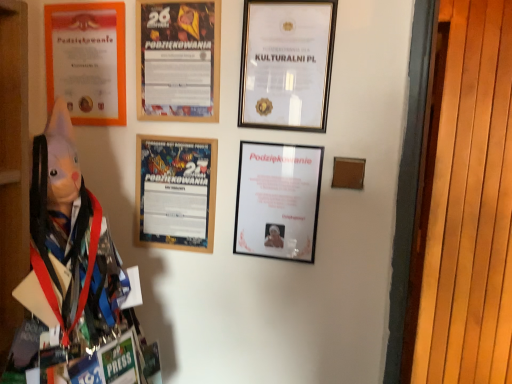
Measure the distance between gold-framed certificate at upper center, placed as the first picture frame when sorted from right to left, and camera.

gold-framed certificate at upper center, placed as the first picture frame when sorted from right to left, is 1.04 meters away from camera.

What do you see at coordinates (278, 200) in the screenshot?
I see `matte black picture frame at center, the third picture frame positioned from the left` at bounding box center [278, 200].

Identify the location of matte black picture frame at center, the 2th picture frame when ordered from right to left. (278, 200).

Identify the location of matte orange certificate at upper left, the first picture frame from the left. (87, 61).

This screenshot has width=512, height=384. I want to click on gold-framed certificate at upper center, placed as the first picture frame when sorted from right to left, so click(286, 64).

Considering the relative positions of matte paper poster at center and wooden framed poster at center, positioned as the 3th picture frame in right-to-left order, in the image provided, is matte paper poster at center to the right of wooden framed poster at center, positioned as the 3th picture frame in right-to-left order, from the viewer's perspective?

Correct, you'll find matte paper poster at center to the right of wooden framed poster at center, positioned as the 3th picture frame in right-to-left order.

Between matte paper poster at center and wooden framed poster at center, positioned as the 3th picture frame in right-to-left order, which one has less height?

wooden framed poster at center, positioned as the 3th picture frame in right-to-left order.

Would you say matte paper poster at center contains wooden framed poster at center, positioned as the 3th picture frame in right-to-left order?

No, wooden framed poster at center, positioned as the 3th picture frame in right-to-left order, is not inside matte paper poster at center.

Is matte paper poster at center smaller than wooden framed poster at center, which is counted as the 2th picture frame, starting from the left?

Incorrect, matte paper poster at center is not smaller in size than wooden framed poster at center, which is counted as the 2th picture frame, starting from the left.

Is wooden framed poster at center, positioned as the 3th picture frame in right-to-left order, at the back of gold-framed certificate at upper center, the fourth picture frame in the left-to-right sequence?

gold-framed certificate at upper center, the fourth picture frame in the left-to-right sequence, is not turned away from wooden framed poster at center, positioned as the 3th picture frame in right-to-left order.

Is gold-framed certificate at upper center, the fourth picture frame in the left-to-right sequence, not near wooden framed poster at center, which is counted as the 2th picture frame, starting from the left?

gold-framed certificate at upper center, the fourth picture frame in the left-to-right sequence, is near wooden framed poster at center, which is counted as the 2th picture frame, starting from the left, not far away.

Does gold-framed certificate at upper center, placed as the first picture frame when sorted from right to left, have a lesser height compared to wooden framed poster at center, which is counted as the 2th picture frame, starting from the left?

No.

From a real-world perspective, is gold-framed certificate at upper center, the fourth picture frame in the left-to-right sequence, on wooden framed poster at center, positioned as the 3th picture frame in right-to-left order?

Yes, from a real-world perspective, gold-framed certificate at upper center, the fourth picture frame in the left-to-right sequence, is above wooden framed poster at center, positioned as the 3th picture frame in right-to-left order.

Is matte orange certificate at upper left, the first picture frame from the left, at the back of gold-framed certificate at upper center, placed as the first picture frame when sorted from right to left?

No, gold-framed certificate at upper center, placed as the first picture frame when sorted from right to left, is not facing away from matte orange certificate at upper left, the first picture frame from the left.

Do you think gold-framed certificate at upper center, placed as the first picture frame when sorted from right to left, is within matte orange certificate at upper left, the fourth picture frame in the right-to-left sequence, or outside of it?

gold-framed certificate at upper center, placed as the first picture frame when sorted from right to left, is not enclosed by matte orange certificate at upper left, the fourth picture frame in the right-to-left sequence.

Which is more to the left, gold-framed certificate at upper center, placed as the first picture frame when sorted from right to left, or matte orange certificate at upper left, the first picture frame from the left?

From the viewer's perspective, matte orange certificate at upper left, the first picture frame from the left, appears more on the left side.

From a real-world perspective, is gold-framed certificate at upper center, placed as the first picture frame when sorted from right to left, beneath matte orange certificate at upper left, the fourth picture frame in the right-to-left sequence?

No, from a real-world perspective, gold-framed certificate at upper center, placed as the first picture frame when sorted from right to left, is not under matte orange certificate at upper left, the fourth picture frame in the right-to-left sequence.

Which object is more forward, matte orange certificate at upper left, the fourth picture frame in the right-to-left sequence, or matte paper poster at center?

matte paper poster at center is more forward.

From a real-world perspective, which object rests below the other?

In real-world perspective, matte orange certificate at upper left, the first picture frame from the left, is lower.

How different are the orientations of matte orange certificate at upper left, the first picture frame from the left, and matte paper poster at center in degrees?

matte orange certificate at upper left, the first picture frame from the left, and matte paper poster at center are facing 0.00135 degrees away from each other.

Identify the location of poster below the matte orange certificate at upper left, the first picture frame from the left (from the image's perspective). (178, 60).

Is matte paper poster at center next to gold-framed certificate at upper center, the fourth picture frame in the left-to-right sequence, and touching it?

They are not placed beside each other.

I want to click on poster below the gold-framed certificate at upper center, placed as the first picture frame when sorted from right to left (from a real-world perspective), so click(x=178, y=60).

Does matte paper poster at center have a lesser width compared to gold-framed certificate at upper center, placed as the first picture frame when sorted from right to left?

No.

Is matte paper poster at center positioned beyond the bounds of matte black picture frame at center, the third picture frame positioned from the left?

Yes.

Is matte black picture frame at center, the third picture frame positioned from the left, at the back of matte paper poster at center?

No, matte paper poster at center is not facing away from matte black picture frame at center, the third picture frame positioned from the left.

Visually, is matte paper poster at center positioned to the left or to the right of matte black picture frame at center, the third picture frame positioned from the left?

matte paper poster at center is positioned on matte black picture frame at center, the third picture frame positioned from the left,'s left side.

From the image's perspective, between matte paper poster at center and matte black picture frame at center, the 2th picture frame when ordered from right to left, which one is located above?

matte paper poster at center, from the image's perspective.

From the image's perspective, which is below, wooden framed poster at center, positioned as the 3th picture frame in right-to-left order, or matte black picture frame at center, the 2th picture frame when ordered from right to left?

matte black picture frame at center, the 2th picture frame when ordered from right to left.

Which of these two, wooden framed poster at center, positioned as the 3th picture frame in right-to-left order, or matte black picture frame at center, the third picture frame positioned from the left, stands taller?

matte black picture frame at center, the third picture frame positioned from the left, is taller.

Could you tell me if wooden framed poster at center, positioned as the 3th picture frame in right-to-left order, is turned towards matte black picture frame at center, the 2th picture frame when ordered from right to left?

No, wooden framed poster at center, positioned as the 3th picture frame in right-to-left order, is not turned towards matte black picture frame at center, the 2th picture frame when ordered from right to left.

This screenshot has height=384, width=512. Identify the location of poster located in front of the wooden framed poster at center, positioned as the 3th picture frame in right-to-left order. (178, 60).

From the image's perspective, count 1st picture frames downward from the gold-framed certificate at upper center, the fourth picture frame in the left-to-right sequence, and point to it. Please provide its 2D coordinates.

[(176, 192)]

Which object lies further to the anchor point matte paper poster at center, matte orange certificate at upper left, the first picture frame from the left, or matte black picture frame at center, the 2th picture frame when ordered from right to left?

matte black picture frame at center, the 2th picture frame when ordered from right to left, is positioned further to the anchor matte paper poster at center.

From the image, which object appears to be nearer to gold-framed certificate at upper center, the fourth picture frame in the left-to-right sequence, wooden framed poster at center, positioned as the 3th picture frame in right-to-left order, or matte orange certificate at upper left, the first picture frame from the left?

Among the two, wooden framed poster at center, positioned as the 3th picture frame in right-to-left order, is located nearer to gold-framed certificate at upper center, the fourth picture frame in the left-to-right sequence.

Estimate the real-world distances between objects in this image. Which object is closer to matte orange certificate at upper left, the fourth picture frame in the right-to-left sequence, matte black picture frame at center, the third picture frame positioned from the left, or wooden framed poster at center, positioned as the 3th picture frame in right-to-left order?

wooden framed poster at center, positioned as the 3th picture frame in right-to-left order, is closer to matte orange certificate at upper left, the fourth picture frame in the right-to-left sequence.

Considering their positions, is matte orange certificate at upper left, the first picture frame from the left, positioned further to matte black picture frame at center, the third picture frame positioned from the left, than gold-framed certificate at upper center, placed as the first picture frame when sorted from right to left?

matte orange certificate at upper left, the first picture frame from the left, is positioned further to the anchor matte black picture frame at center, the third picture frame positioned from the left.

From the image, which object appears to be nearer to matte black picture frame at center, the third picture frame positioned from the left, matte orange certificate at upper left, the first picture frame from the left, or wooden framed poster at center, which is counted as the 2th picture frame, starting from the left?

Among the two, wooden framed poster at center, which is counted as the 2th picture frame, starting from the left, is located nearer to matte black picture frame at center, the third picture frame positioned from the left.

Considering their positions, is matte paper poster at center positioned further to gold-framed certificate at upper center, the fourth picture frame in the left-to-right sequence, than matte orange certificate at upper left, the fourth picture frame in the right-to-left sequence?

Among the two, matte orange certificate at upper left, the fourth picture frame in the right-to-left sequence, is located further to gold-framed certificate at upper center, the fourth picture frame in the left-to-right sequence.

From the image, which object appears to be farther from wooden framed poster at center, positioned as the 3th picture frame in right-to-left order, gold-framed certificate at upper center, placed as the first picture frame when sorted from right to left, or matte orange certificate at upper left, the first picture frame from the left?

gold-framed certificate at upper center, placed as the first picture frame when sorted from right to left, lies further to wooden framed poster at center, positioned as the 3th picture frame in right-to-left order, than the other object.

Looking at the image, which one is located further to matte paper poster at center, matte black picture frame at center, the third picture frame positioned from the left, or matte orange certificate at upper left, the fourth picture frame in the right-to-left sequence?

The object further to matte paper poster at center is matte black picture frame at center, the third picture frame positioned from the left.

What are the coordinates of `poster between matte orange certificate at upper left, the first picture frame from the left, and matte black picture frame at center, the third picture frame positioned from the left` in the screenshot? It's located at [178, 60].

You are a GUI agent. You are given a task and a screenshot of the screen. Output one action in this format:
    pyautogui.click(x=<x>, y=<y>)
    Task: Click on the poster located between matte orange certificate at upper left, the first picture frame from the left, and gold-framed certificate at upper center, placed as the first picture frame when sorted from right to left, in the left-right direction
    
    Given the screenshot: What is the action you would take?
    pyautogui.click(x=178, y=60)

The width and height of the screenshot is (512, 384). In order to click on picture frame between matte orange certificate at upper left, the first picture frame from the left, and matte black picture frame at center, the 2th picture frame when ordered from right to left, in the horizontal direction in this screenshot , I will do `click(176, 192)`.

I want to click on picture frame that lies between matte paper poster at center and wooden framed poster at center, which is counted as the 2th picture frame, starting from the left, from top to bottom, so click(x=286, y=64).